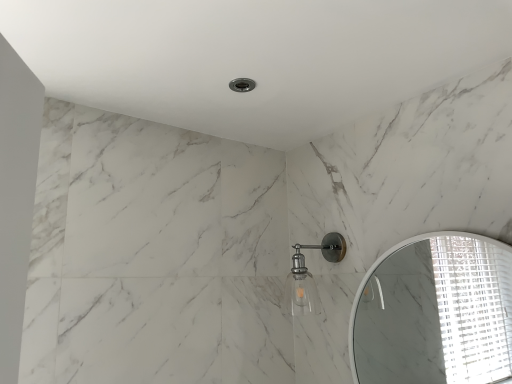
Question: Considering the relative positions of satin nickel fixture at upper center and white glossy mirror at upper right in the image provided, is satin nickel fixture at upper center to the right of white glossy mirror at upper right from the viewer's perspective?

Choices:
 (A) yes
 (B) no

Answer: (B)

Question: From the image's perspective, is satin nickel fixture at upper center beneath white glossy mirror at upper right?

Choices:
 (A) yes
 (B) no

Answer: (B)

Question: Considering the relative positions of satin nickel fixture at upper center and white glossy mirror at upper right in the image provided, is satin nickel fixture at upper center to the left of white glossy mirror at upper right from the viewer's perspective?

Choices:
 (A) yes
 (B) no

Answer: (A)

Question: Is satin nickel fixture at upper center smaller than white glossy mirror at upper right?

Choices:
 (A) no
 (B) yes

Answer: (B)

Question: Is the depth of satin nickel fixture at upper center less than that of white glossy mirror at upper right?

Choices:
 (A) no
 (B) yes

Answer: (A)

Question: Can you confirm if satin nickel fixture at upper center is taller than white glossy mirror at upper right?

Choices:
 (A) yes
 (B) no

Answer: (B)

Question: Is white glossy mirror at upper right wider than satin nickel fixture at upper center?

Choices:
 (A) no
 (B) yes

Answer: (A)

Question: From the image's perspective, is white glossy mirror at upper right under satin nickel fixture at upper center?

Choices:
 (A) yes
 (B) no

Answer: (A)

Question: Does white glossy mirror at upper right have a smaller size compared to satin nickel fixture at upper center?

Choices:
 (A) yes
 (B) no

Answer: (B)

Question: Does white glossy mirror at upper right come in front of satin nickel fixture at upper center?

Choices:
 (A) yes
 (B) no

Answer: (A)

Question: Is white glossy mirror at upper right to the left of satin nickel fixture at upper center from the viewer's perspective?

Choices:
 (A) no
 (B) yes

Answer: (A)

Question: Is the position of white glossy mirror at upper right more distant than that of satin nickel fixture at upper center?

Choices:
 (A) yes
 (B) no

Answer: (B)

Question: Is white glossy mirror at upper right situated inside satin nickel fixture at upper center or outside?

Choices:
 (A) inside
 (B) outside

Answer: (B)